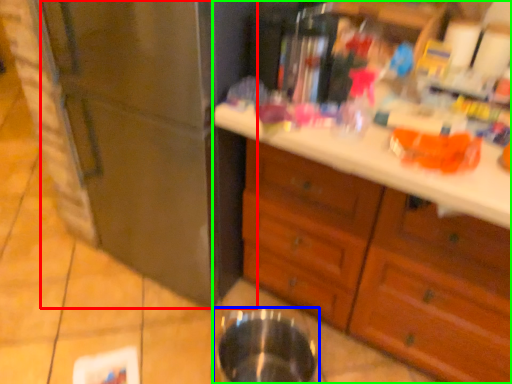
Question: Which is nearer to the refrigerator (highlighted by a red box)? basin (highlighted by a blue box) or cabinetry (highlighted by a green box).

Choices:
 (A) basin
 (B) cabinetry

Answer: (B)